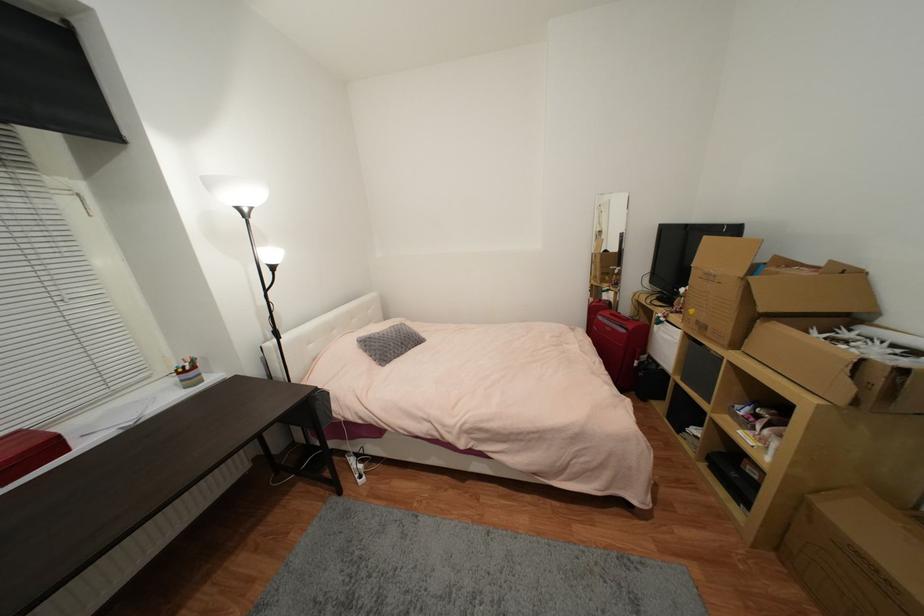
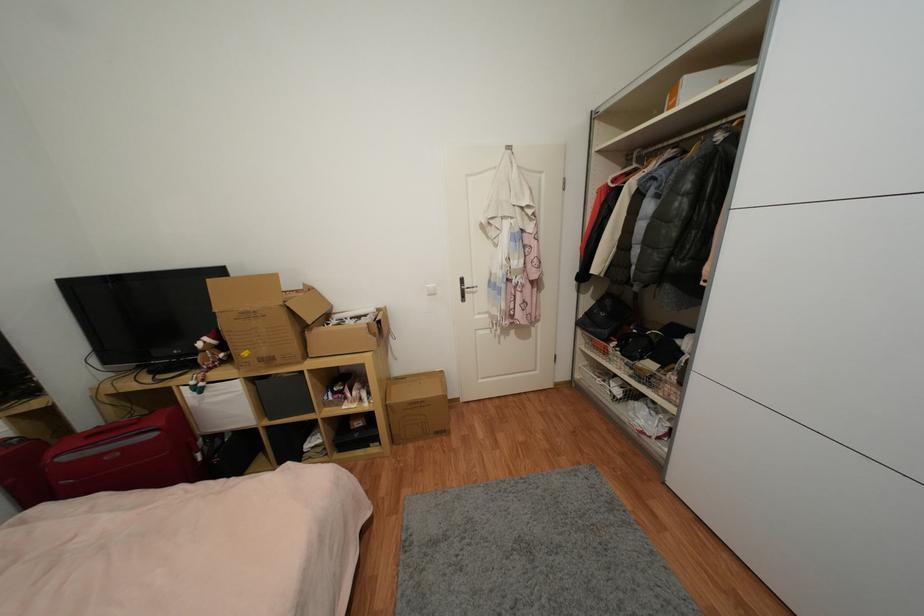
The point at [666,321] is marked in the first image. Where is the corresponding point in the second image?

(205, 386)